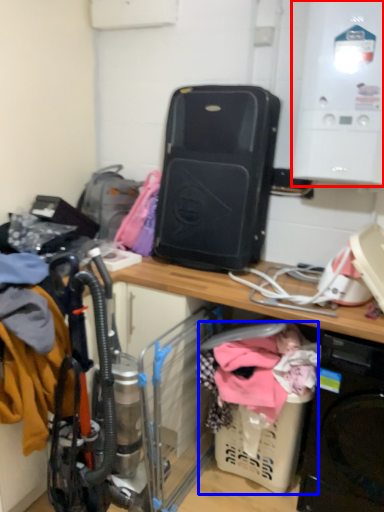
Question: Which object appears farthest to the camera in this image, appliance (highlighted by a red box) or baby carriage (highlighted by a blue box)?

Choices:
 (A) appliance
 (B) baby carriage

Answer: (B)